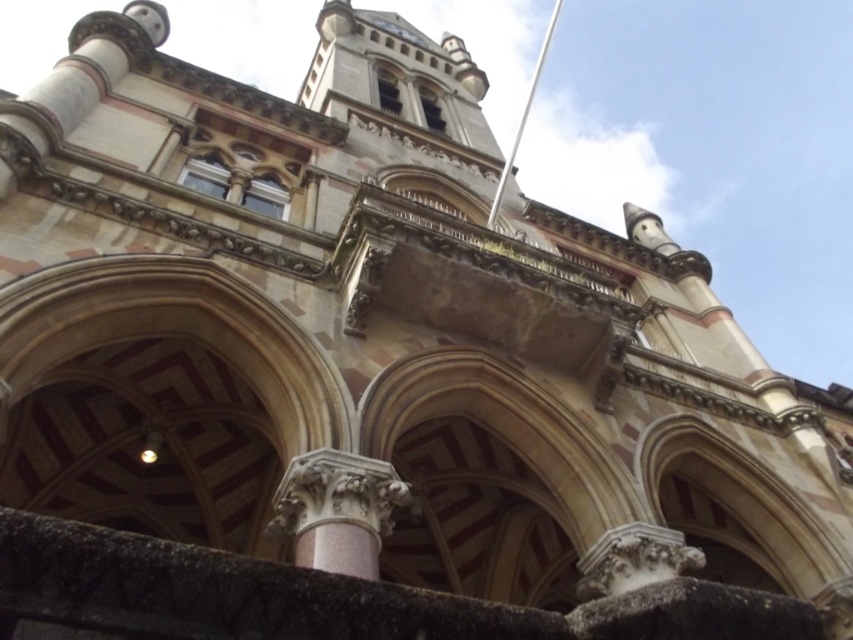
Question: Observing the image, what is the correct spatial positioning of pink stone column at center in reference to white metallic flag pole at upper center?

Choices:
 (A) right
 (B) left

Answer: (B)

Question: Can you confirm if pink stone column at center is wider than white metallic flag pole at upper center?

Choices:
 (A) no
 (B) yes

Answer: (A)

Question: Which point is closer to the camera taking this photo?

Choices:
 (A) (495, 218)
 (B) (346, 554)

Answer: (B)

Question: Is pink stone column at center to the left of white metallic flag pole at upper center from the viewer's perspective?

Choices:
 (A) no
 (B) yes

Answer: (B)